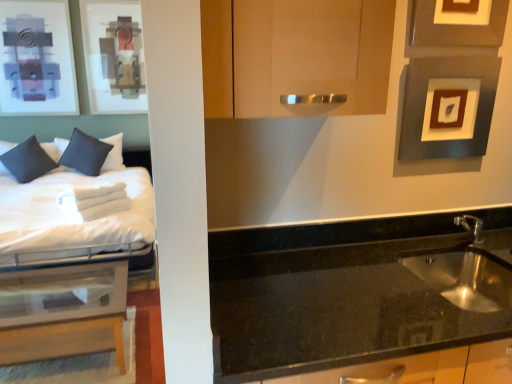
Question: Is black granite sink at lower right wider or thinner than matte gray picture frame at upper right, placed as the second picture frame when sorted from top to bottom?

Choices:
 (A) thin
 (B) wide

Answer: (B)

Question: From a real-world perspective, is black granite sink at lower right physically located above or below matte gray picture frame at upper right, placed as the second picture frame when sorted from top to bottom?

Choices:
 (A) above
 (B) below

Answer: (B)

Question: Which object is the closest to the matte gray picture frame at upper right, positioned as the first picture frame in top-to-bottom order?

Choices:
 (A) white soft bed at left
 (B) matte wood cabinet at center
 (C) matte black pillow at left, which is the 1th pillow from right to left
 (D) black granite sink at lower right
 (E) silver metallic faucet at lower right

Answer: (B)

Question: Which object is the farthest from the translucent glass table at left?

Choices:
 (A) matte gray picture frame at upper right, placed as the second picture frame when sorted from top to bottom
 (B) matte black pillow at left, the second pillow when ordered from left to right
 (C) dark blue fabric pillow at left, which appears as the first pillow when viewed from the left
 (D) matte wood cabinet at center
 (E) black granite sink at lower right

Answer: (C)